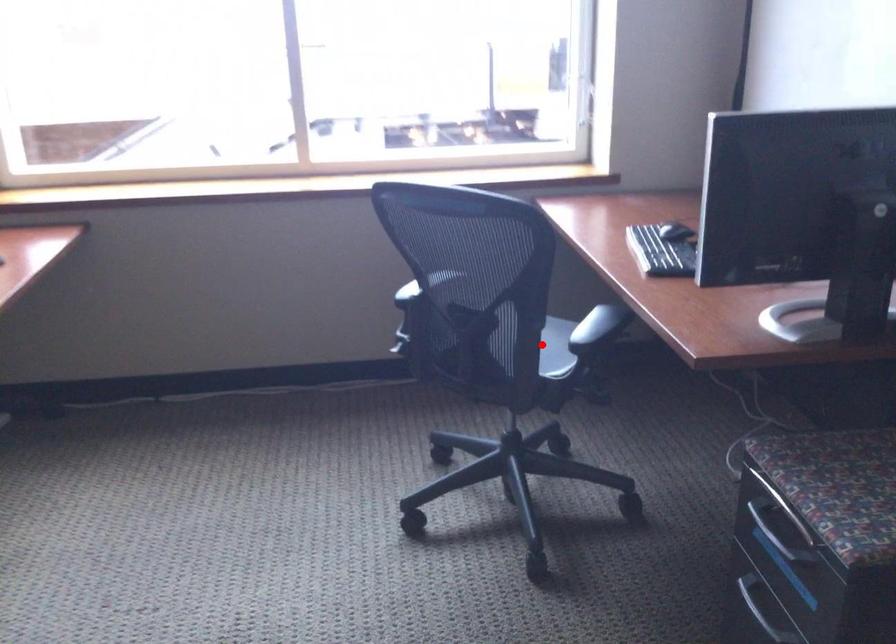
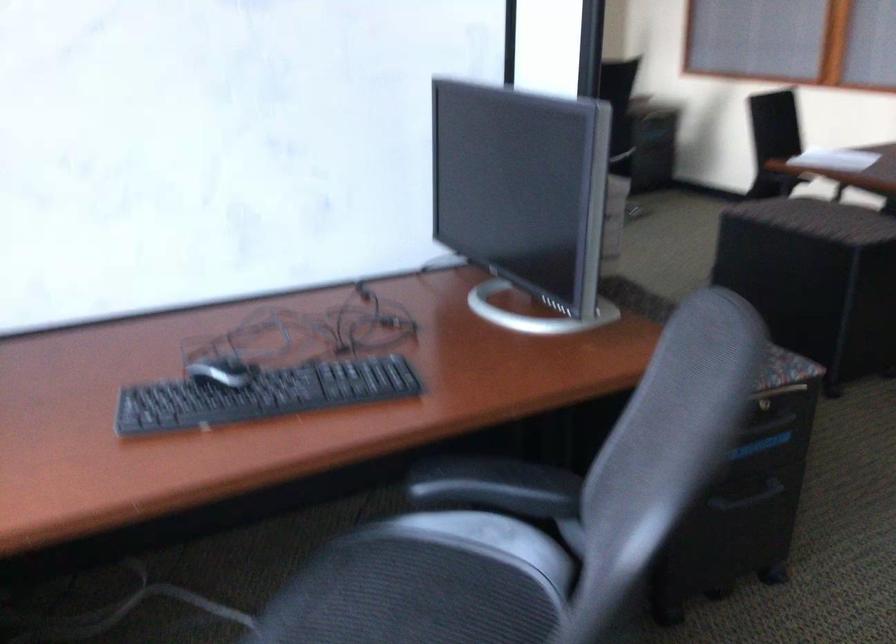
Question: I am providing you with two images of the same scene from different viewpoints. A red point is marked on the first image. Is the red point's position out of view in image 2?

Choices:
 (A) Yes
 (B) No

Answer: (A)